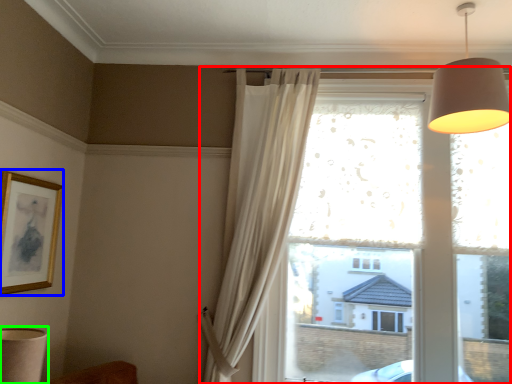
Question: Which object is positioned closest to window (highlighted by a red box)? Select from picture frame (highlighted by a blue box) and table lamp (highlighted by a green box).

Choices:
 (A) picture frame
 (B) table lamp

Answer: (A)